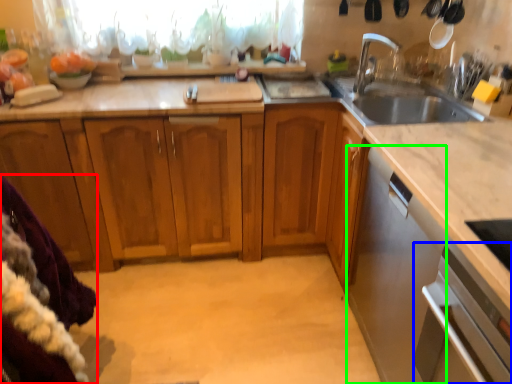
Question: Which is farther away from blanket (highlighted by a red box)? oven (highlighted by a blue box) or dish washer (highlighted by a green box)?

Choices:
 (A) oven
 (B) dish washer

Answer: (B)